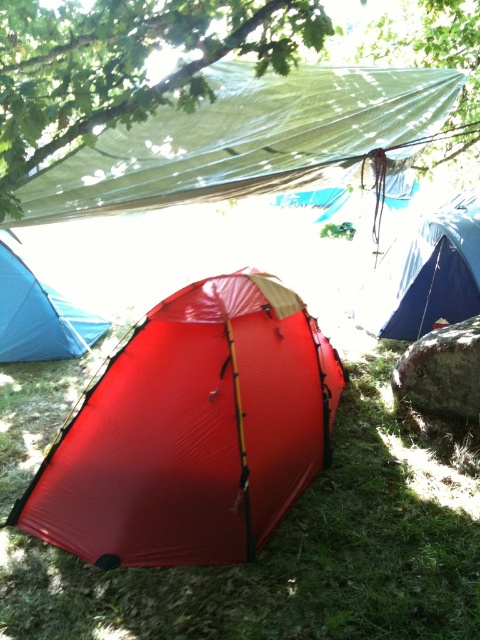
Question: Is green grass at center to the left of green tarpaulin at upper center from the viewer's perspective?

Choices:
 (A) no
 (B) yes

Answer: (B)

Question: Which object appears farthest from the camera in this image?

Choices:
 (A) green tarpaulin at upper center
 (B) shiny red tent at center
 (C) matte red tent at center
 (D) green grass at center

Answer: (C)

Question: Is shiny red tent at center positioned behind green matte tarp at upper center?

Choices:
 (A) yes
 (B) no

Answer: (B)

Question: Which point is closer to the camera?

Choices:
 (A) (365, 45)
 (B) (12, 316)
 (C) (87, 186)
 (D) (21, 381)

Answer: (C)

Question: Which of these objects is positioned farthest from the green tarpaulin at upper center?

Choices:
 (A) blue tarpaulin tent at right
 (B) shiny red tent at center

Answer: (A)

Question: Is green tarpaulin at upper center closer to the viewer compared to blue tarpaulin tent at right?

Choices:
 (A) no
 (B) yes

Answer: (B)